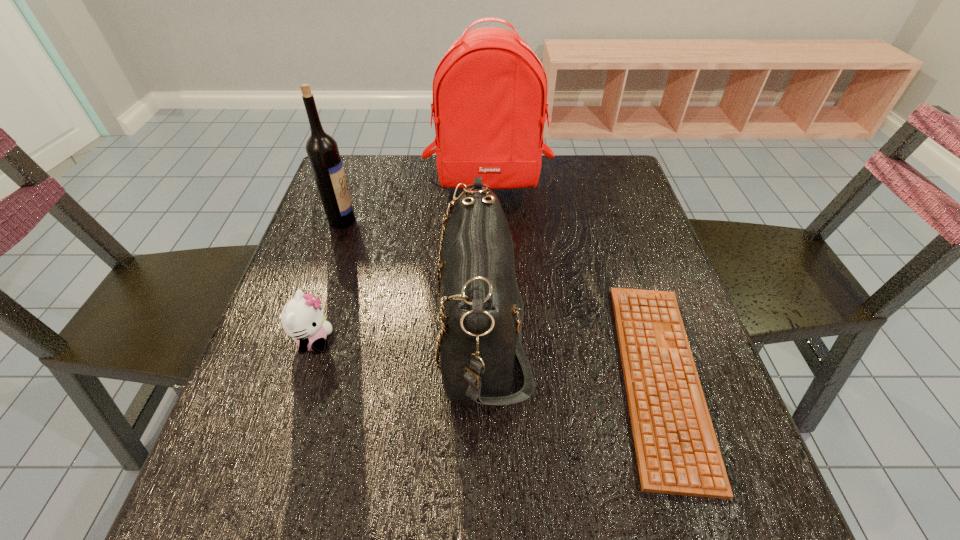
This screenshot has height=540, width=960. In order to click on free region that satisfies the following two spatial constraints: 1. on the main compartment of the tallest object; 2. on the label of the fourth nearest object in this screenshot , I will do `click(489, 220)`.

The height and width of the screenshot is (540, 960). I want to click on free spot that satisfies the following two spatial constraints: 1. at the front of the handbag with chain and zipper; 2. on the back side of the computer keyboard, so tap(483, 377).

I want to click on vacant position in the image that satisfies the following two spatial constraints: 1. on the main compartment of the farthest object; 2. on the left side of the rightmost object, so click(492, 377).